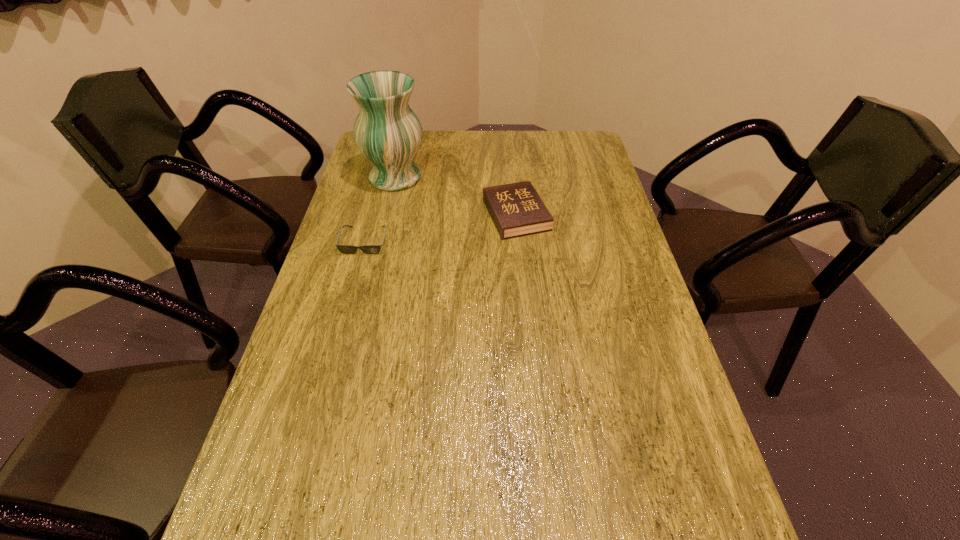
Identify the location of object located at the far left corner. (388, 133).

You are a GUI agent. You are given a task and a screenshot of the screen. Output one action in this format:
    pyautogui.click(x=<x>, y=<y>)
    Task: Click on the vacant space at the far edge of the desktop
    The height and width of the screenshot is (540, 960).
    Given the screenshot: What is the action you would take?
    pyautogui.click(x=454, y=146)

In the image, there is a desktop. Where is `vacant space at the left edge`? This screenshot has width=960, height=540. vacant space at the left edge is located at coordinates (349, 291).

Image resolution: width=960 pixels, height=540 pixels. In order to click on vacant space at the right edge of the desktop in this screenshot , I will do `click(619, 271)`.

Locate an element on the screen. This screenshot has width=960, height=540. free space between the shortest object and the rightmost object is located at coordinates (441, 228).

Identify the location of free space between the rightmost object and the sunglasses. (441, 228).

Locate an element on the screen. The image size is (960, 540). vacant point located between the sunglasses and the second shortest object is located at coordinates (441, 228).

The height and width of the screenshot is (540, 960). I want to click on vacant area between the tallest object and the second tallest object, so click(456, 196).

The width and height of the screenshot is (960, 540). Identify the location of vacant point located between the second shortest object and the sunglasses. (441, 228).

The image size is (960, 540). Identify the location of object that is the nearest to the vase. (345, 249).